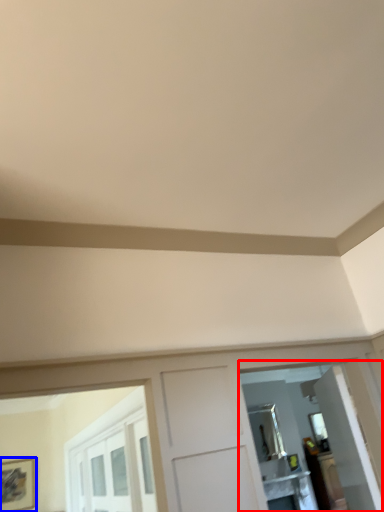
Question: Among these objects, which one is nearest to the camera, mirror (highlighted by a red box) or picture frame (highlighted by a blue box)?

Choices:
 (A) mirror
 (B) picture frame

Answer: (A)